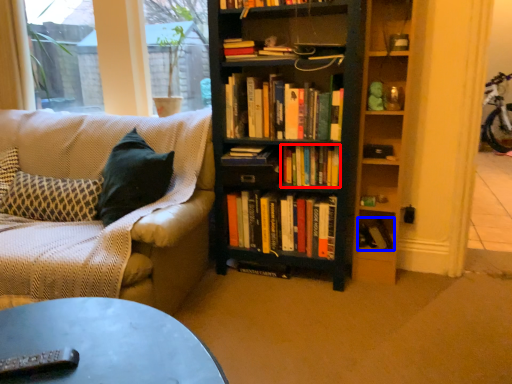
Question: Which object appears closest to the camera in this image, book (highlighted by a red box) or book (highlighted by a blue box)?

Choices:
 (A) book
 (B) book

Answer: (A)